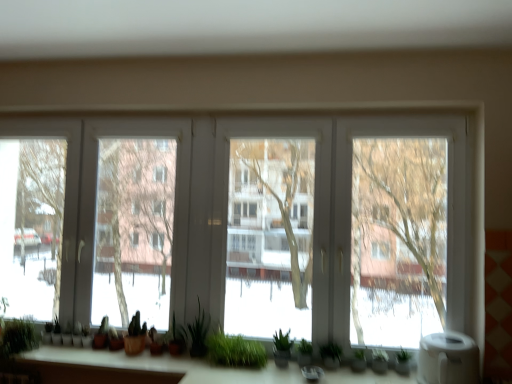
Identify the location of vacant space in front of green matte plant at center, the fourth plant in the right-to-left sequence. (163, 359).